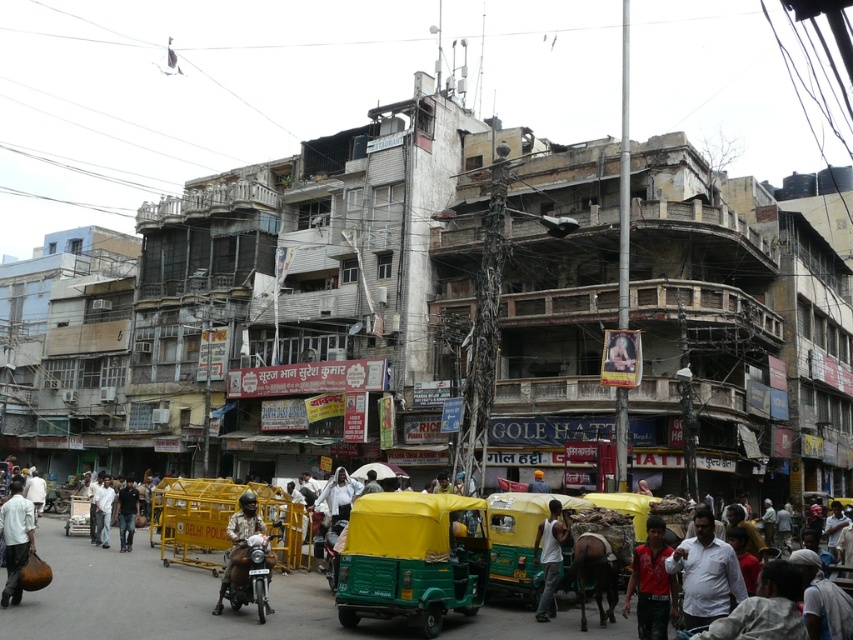
Question: Can you confirm if red shirt at center is bigger than light brown leather jacket at center?

Choices:
 (A) yes
 (B) no

Answer: (B)

Question: In this image, where is red shirt at center located relative to white matte jacket at center?

Choices:
 (A) left
 (B) right

Answer: (B)

Question: Which is farther from the yellow fabric turban at center?

Choices:
 (A) smooth skin portrait at center
 (B) yellow fabric rickshaw at center
 (C) light brown leather jacket at center

Answer: (C)

Question: Is light brown fabric shirt at lower right behind light brown leather jacket at center?

Choices:
 (A) no
 (B) yes

Answer: (A)

Question: Which point is farther to the camera?

Choices:
 (A) click(x=775, y=566)
 (B) click(x=413, y=570)
 (C) click(x=544, y=486)
 (D) click(x=276, y=524)

Answer: (C)

Question: Which point is farther from the camera taking this photo?

Choices:
 (A) (7, 554)
 (B) (331, 500)
 (C) (125, 492)
 (D) (787, 580)

Answer: (C)